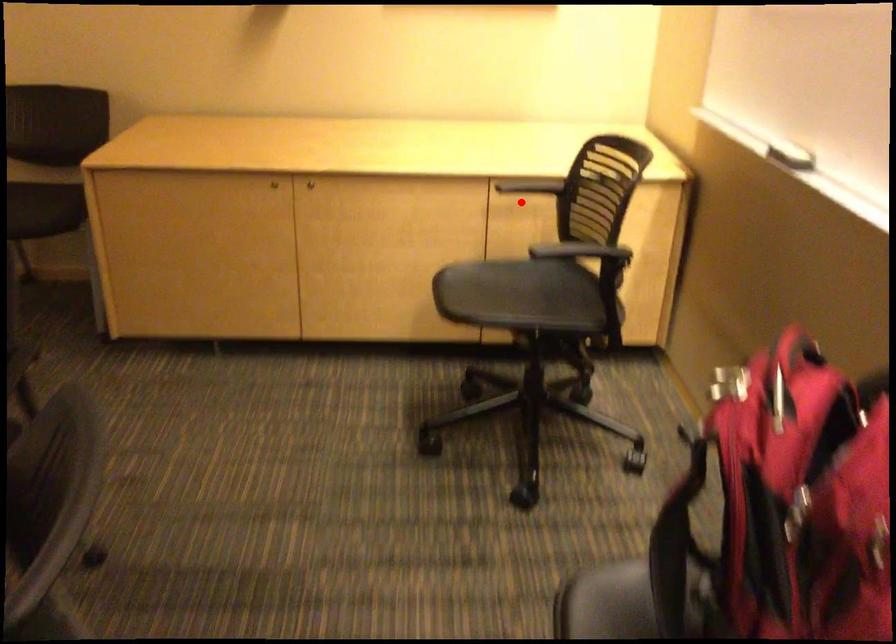
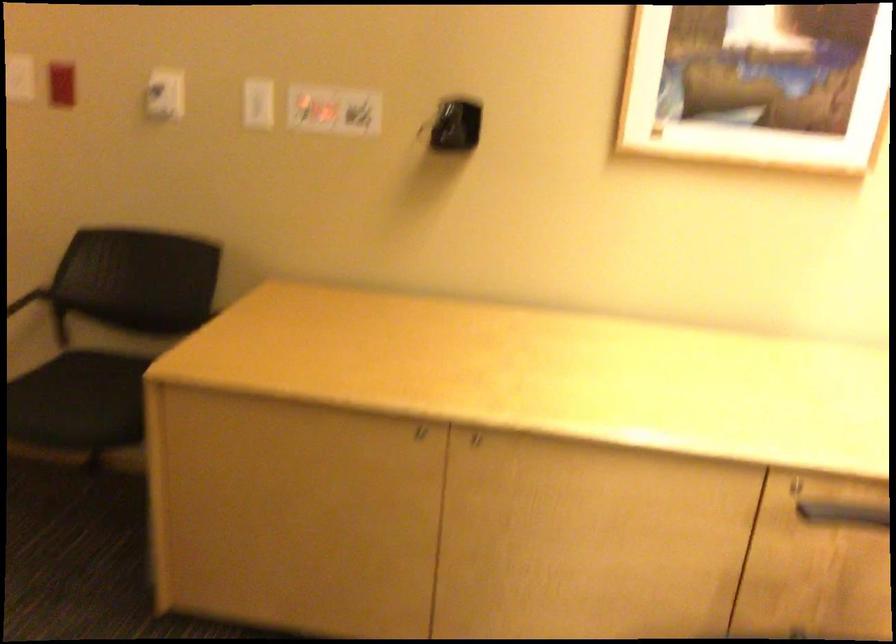
Question: I am providing you with two images of the same scene from different viewpoints. Given a red point in image1, look at the same physical point in image2. Is it:

Choices:
 (A) Closer to the viewpoint
 (B) Farther from the viewpoint

Answer: (A)